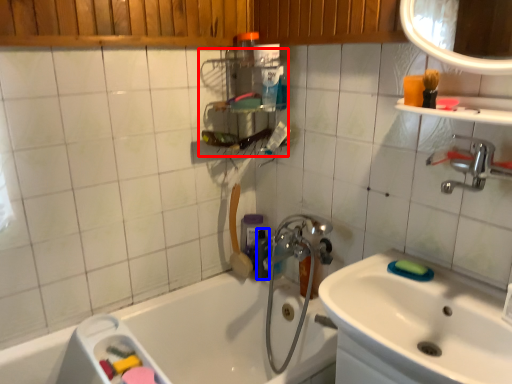
Question: Among these objects, which one is farthest to the camera, shelf (highlighted by a red box) or toiletry (highlighted by a blue box)?

Choices:
 (A) shelf
 (B) toiletry

Answer: (B)